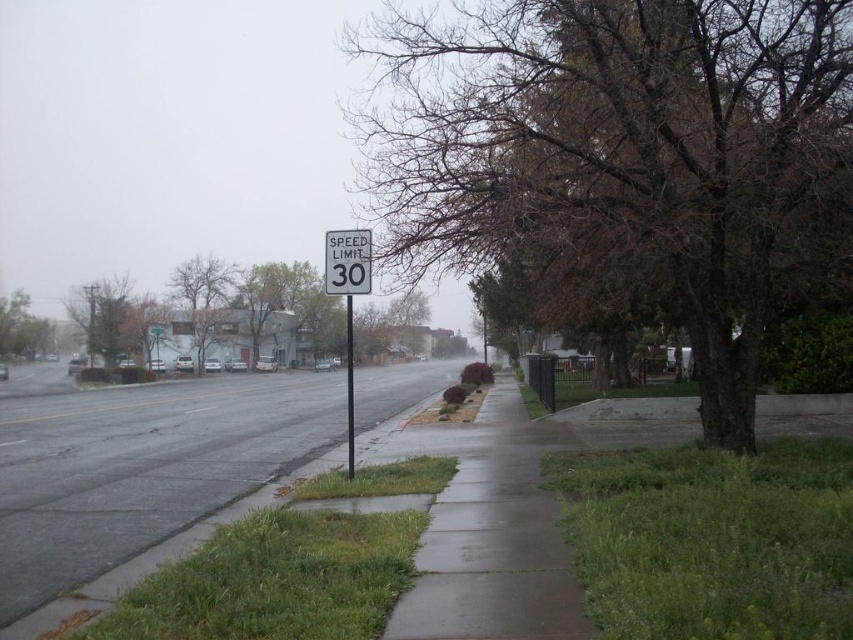
Question: Which point is farther to the camera?

Choices:
 (A) green leafy tree at left
 (B) metallic pole at center

Answer: (A)

Question: Where is gray asphalt sidewalk at center located in relation to brown leafless tree at left in the image?

Choices:
 (A) right
 (B) left

Answer: (A)

Question: Which is farther from the brown leafless tree at left?

Choices:
 (A) metallic pole at center
 (B) white plastic speed limit sign at center

Answer: (B)

Question: In this image, where is brown leafless tree at left located relative to green leafy tree at left?

Choices:
 (A) below
 (B) above

Answer: (B)

Question: Is gray asphalt sidewalk at center behind metallic pole at center?

Choices:
 (A) yes
 (B) no

Answer: (B)

Question: Which is nearer to the gray asphalt sidewalk at center?

Choices:
 (A) white plastic speed limit sign at center
 (B) brown textured tree at center
 (C) metallic pole at center

Answer: (C)